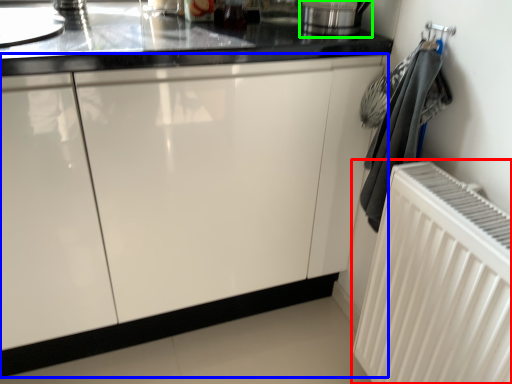
Question: Which is farther away from radiator (highlighted by a red box)? cabinetry (highlighted by a blue box) or appliance (highlighted by a green box)?

Choices:
 (A) cabinetry
 (B) appliance

Answer: (B)